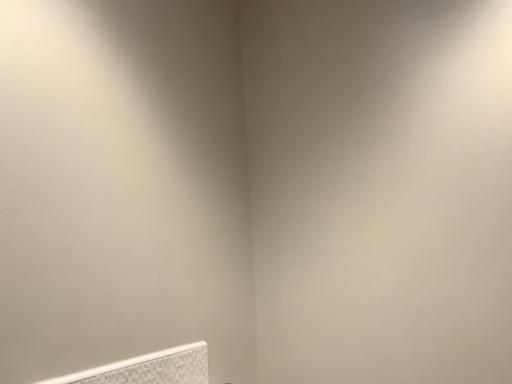
Measure the distance between point (206, 358) and camera.

1.05 meters.

The image size is (512, 384). In order to click on white textured mattress at lower left in this screenshot , I will do `click(149, 369)`.

What is the approximate height of white textured mattress at lower left?

The height of white textured mattress at lower left is 13.47 inches.

Image resolution: width=512 pixels, height=384 pixels. Describe the element at coordinates (149, 369) in the screenshot. I see `white textured mattress at lower left` at that location.

Image resolution: width=512 pixels, height=384 pixels. I want to click on white textured mattress at lower left, so click(x=149, y=369).